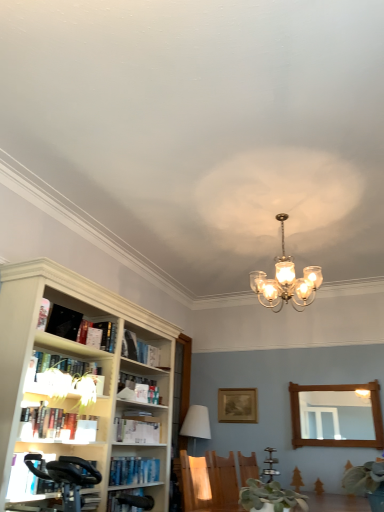
Question: From a real-world perspective, is hardcover book at lower left, positioned as the 2th book in bottom-to-top order, physically located above or below white paper book at left, placed as the fifth book when sorted from top to bottom?

Choices:
 (A) above
 (B) below

Answer: (B)

Question: Considering the positions of hardcover book at lower left, the 9th book from the top, and white paper book at left, which is the 6th book in bottom-to-top order, in the image, is hardcover book at lower left, the 9th book from the top, taller or shorter than white paper book at left, which is the 6th book in bottom-to-top order,?

Choices:
 (A) short
 (B) tall

Answer: (A)

Question: Estimate the real-world distances between objects in this image. Which object is farther from the hardcover book at left, which is the fourth book in bottom-to-top order?

Choices:
 (A) translucent glass chandelier at upper center, the second lamp in the left-to-right sequence
 (B) wooden picture frame at center
 (C) hardcover book at center, which is the sixth book in top-to-bottom order
 (D) wooden mirror at right
 (E) hardcover book at left, arranged as the seventh book when ordered from the bottom

Answer: (D)

Question: Estimate the real-world distances between objects in this image. Which object is closer to the white paper book at left, which is the 8th book in top-to-bottom order?

Choices:
 (A) black matte bookshelf at upper left, the ninth book in the bottom-to-top sequence
 (B) green matte plant at lower center
 (C) white matte bookshelf at upper left, arranged as the tenth book when ordered from the bottom
 (D) white fabric lampshade at center, which ranks as the second lamp in right-to-left order
 (E) wooden chair at lower center

Answer: (D)